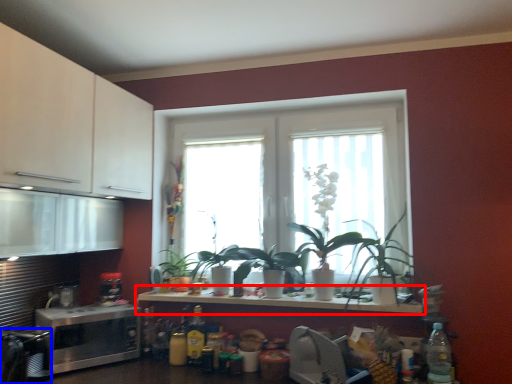
Question: Among these objects, which one is nearest to the camera, countertop (highlighted by a red box) or appliance (highlighted by a blue box)?

Choices:
 (A) countertop
 (B) appliance

Answer: (B)